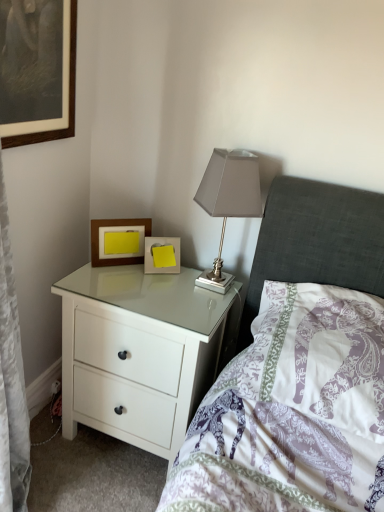
Question: Considering the relative positions of wooden framed picture at upper left, positioned as the third picture frame in bottom-to-top order, and yellow paper at center, the 1th picture frame in the bottom-to-top sequence, in the image provided, is wooden framed picture at upper left, positioned as the third picture frame in bottom-to-top order, to the right of yellow paper at center, the 1th picture frame in the bottom-to-top sequence, from the viewer's perspective?

Choices:
 (A) no
 (B) yes

Answer: (A)

Question: Is wooden framed picture at upper left, the 1th picture frame viewed from the left, positioned in front of yellow paper at center, the 3th picture frame positioned from the top?

Choices:
 (A) yes
 (B) no

Answer: (A)

Question: Is wooden framed picture at upper left, which is the third picture frame from right to left, shorter than yellow paper at center, the 3th picture frame positioned from the top?

Choices:
 (A) yes
 (B) no

Answer: (B)

Question: Is wooden framed picture at upper left, which is the third picture frame from right to left, not within yellow paper at center, the 1th picture frame in the bottom-to-top sequence?

Choices:
 (A) yes
 (B) no

Answer: (A)

Question: Is yellow paper at center, which is the 1th picture frame in right-to-left order, a part of wooden framed picture at upper left, the 1th picture frame viewed from the left?

Choices:
 (A) no
 (B) yes

Answer: (A)

Question: Considering the relative sizes of wooden framed picture at upper left, the 1th picture frame viewed from the left, and yellow paper at center, the 1th picture frame in the bottom-to-top sequence, in the image provided, is wooden framed picture at upper left, the 1th picture frame viewed from the left, bigger than yellow paper at center, the 1th picture frame in the bottom-to-top sequence,?

Choices:
 (A) no
 (B) yes

Answer: (B)

Question: Is yellow paper at center, the 3th picture frame positioned from the top, thinner than satin silver table lamp at upper right?

Choices:
 (A) yes
 (B) no

Answer: (A)

Question: Is satin silver table lamp at upper right completely or partially inside yellow paper at center, the 3th picture frame positioned from the top?

Choices:
 (A) no
 (B) yes

Answer: (A)

Question: Can you confirm if yellow paper at center, which is the third picture frame from left to right, is positioned to the right of satin silver table lamp at upper right?

Choices:
 (A) yes
 (B) no

Answer: (B)

Question: Is the position of yellow paper at center, which is the 1th picture frame in right-to-left order, more distant than that of satin silver table lamp at upper right?

Choices:
 (A) yes
 (B) no

Answer: (A)

Question: Does yellow paper at center, which is the third picture frame from left to right, have a greater width compared to satin silver table lamp at upper right?

Choices:
 (A) no
 (B) yes

Answer: (A)

Question: From the image's perspective, does yellow paper at center, the 1th picture frame in the bottom-to-top sequence, appear higher than satin silver table lamp at upper right?

Choices:
 (A) yes
 (B) no

Answer: (B)

Question: Is white glossy chest of drawers at center not within yellow paper at center, which is the third picture frame from left to right?

Choices:
 (A) yes
 (B) no

Answer: (A)